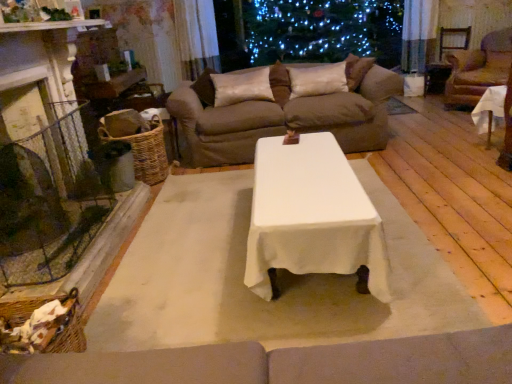
Question: Is satin cushion at center, acting as the second pillow starting from the right, at the back of white cloth-covered table at right?

Choices:
 (A) yes
 (B) no

Answer: (B)

Question: Is white cloth-covered table at right next to satin cushion at center, the first pillow positioned from the left, and touching it?

Choices:
 (A) yes
 (B) no

Answer: (B)

Question: Is satin cushion at center, the first pillow positioned from the left, a part of white cloth-covered table at right?

Choices:
 (A) yes
 (B) no

Answer: (B)

Question: Would you say white cloth-covered table at right is outside satin cushion at center, acting as the second pillow starting from the right?

Choices:
 (A) yes
 (B) no

Answer: (A)

Question: Can you confirm if white cloth-covered table at right is positioned to the left of satin cushion at center, the first pillow positioned from the left?

Choices:
 (A) no
 (B) yes

Answer: (A)

Question: Considering the positions of point (172, 94) and point (339, 69), is point (172, 94) closer or farther from the camera than point (339, 69)?

Choices:
 (A) farther
 (B) closer

Answer: (B)

Question: Which is correct: brown fabric couch at upper center is inside silky beige pillow at center, the 1th pillow in the right-to-left sequence, or outside of it?

Choices:
 (A) inside
 (B) outside

Answer: (B)

Question: Looking at the image, does brown fabric couch at upper center seem bigger or smaller compared to silky beige pillow at center, the 1th pillow in the right-to-left sequence?

Choices:
 (A) small
 (B) big

Answer: (B)

Question: From the image's perspective, is brown fabric couch at upper center above or below silky beige pillow at center, the 1th pillow in the right-to-left sequence?

Choices:
 (A) below
 (B) above

Answer: (A)

Question: Is silky beige pillow at center, placed as the 2th pillow when sorted from left to right, wider or thinner than white cloth-covered table at right?

Choices:
 (A) thin
 (B) wide

Answer: (A)

Question: In terms of size, does silky beige pillow at center, placed as the 2th pillow when sorted from left to right, appear bigger or smaller than white cloth-covered table at right?

Choices:
 (A) small
 (B) big

Answer: (A)

Question: Is silky beige pillow at center, placed as the 2th pillow when sorted from left to right, inside or outside of white cloth-covered table at right?

Choices:
 (A) outside
 (B) inside

Answer: (A)

Question: In terms of height, does silky beige pillow at center, the 1th pillow in the right-to-left sequence, look taller or shorter compared to white cloth-covered table at right?

Choices:
 (A) short
 (B) tall

Answer: (A)

Question: From the image's perspective, is woven brown basket at left located above or below brown leather armchair at right?

Choices:
 (A) below
 (B) above

Answer: (A)

Question: Would you say woven brown basket at left is inside or outside brown leather armchair at right?

Choices:
 (A) outside
 (B) inside

Answer: (A)